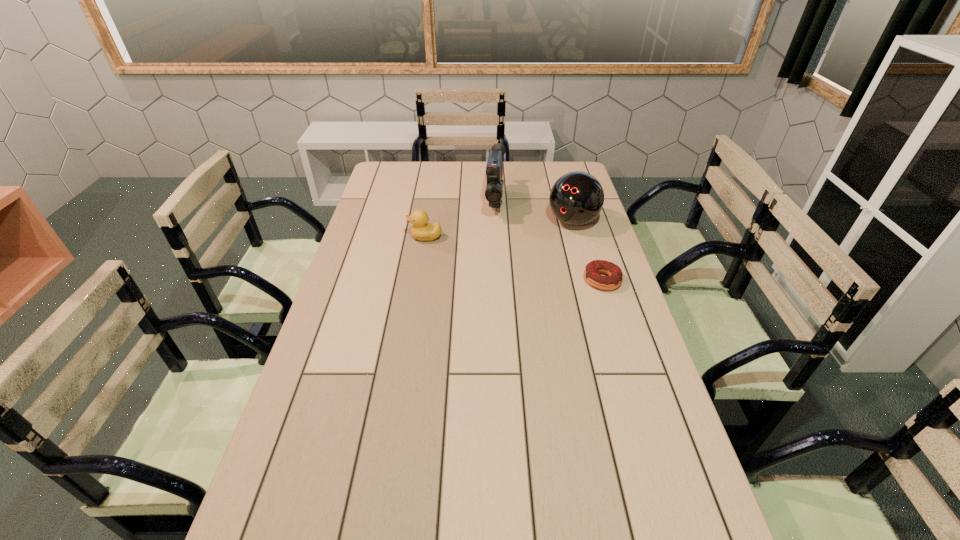
Locate an element on the screen. The image size is (960, 540). free space between the bowling ball and the nearest object is located at coordinates (588, 251).

Where is `vacant space that's between the bowling ball and the duckling`? This screenshot has width=960, height=540. vacant space that's between the bowling ball and the duckling is located at coordinates (499, 230).

Identify the location of vacant space that's between the nearest object and the bowling ball. Image resolution: width=960 pixels, height=540 pixels. (588, 251).

I want to click on vacant region between the doughnut and the duckling, so click(x=514, y=259).

Point out which object is positioned as the second nearest to the duckling. Please provide its 2D coordinates. Your answer should be formatted as a tuple, i.e. [(x, y)], where the tuple contains the x and y coordinates of a point satisfying the conditions above.

[(576, 198)]

I want to click on the closest object relative to the second shortest object, so click(x=494, y=170).

Image resolution: width=960 pixels, height=540 pixels. I want to click on vacant point that satisfies the following two spatial constraints: 1. on the front side of the shortest object; 2. on the right side of the bowling ball, so click(x=589, y=280).